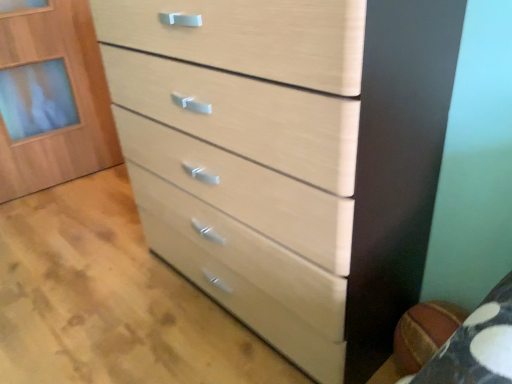
Question: Is light wood/texture chest of drawers at center bigger or smaller than light wood cabinet at upper left?

Choices:
 (A) big
 (B) small

Answer: (A)

Question: From a real-world perspective, is light wood/texture chest of drawers at center positioned above or below light wood cabinet at upper left?

Choices:
 (A) below
 (B) above

Answer: (B)

Question: Which of these objects is positioned farthest from the light wood drawer at center?

Choices:
 (A) light wood cabinet at upper left
 (B) light wood/texture chest of drawers at center

Answer: (A)

Question: Based on their relative distances, which object is nearer to the light wood cabinet at upper left?

Choices:
 (A) light wood/texture chest of drawers at center
 (B) light wood drawer at center

Answer: (B)